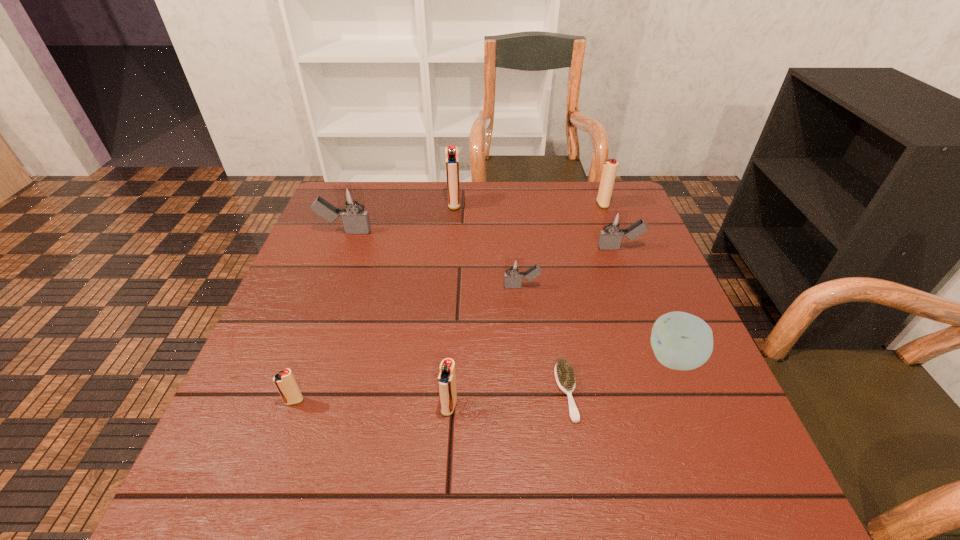
Identify the location of blank space located on the back of the smallest red igniter. This screenshot has height=540, width=960. (343, 266).

In order to click on vacant space located on the back of the smallest gray igniter in this screenshot , I will do `click(520, 267)`.

You are a GUI agent. You are given a task and a screenshot of the screen. Output one action in this format:
    pyautogui.click(x=<x>, y=<y>)
    Task: Click on the vacant space located on the right of the shortest object
    
    Given the screenshot: What is the action you would take?
    pyautogui.click(x=603, y=392)

You are a GUI agent. You are given a task and a screenshot of the screen. Output one action in this format:
    pyautogui.click(x=<x>, y=<y>)
    Task: Click on the apple that is at the right edge
    Image resolution: width=960 pixels, height=540 pixels.
    Given the screenshot: What is the action you would take?
    pyautogui.click(x=681, y=341)

Find the location of a particular element. object present at the far left corner is located at coordinates coord(355,220).

At what (x,y) coordinates should I click in order to perform the action: click on object located in the far right corner section of the desktop. Please return your answer as a coordinate pair (x, y). This screenshot has width=960, height=540. Looking at the image, I should click on (609, 170).

Locate an element on the screen. The height and width of the screenshot is (540, 960). vacant point at the far edge is located at coordinates (440, 214).

Locate an element on the screen. vacant region at the near edge of the desktop is located at coordinates (374, 474).

In the image, there is a desktop. Where is `vacant space at the left edge`? This screenshot has width=960, height=540. vacant space at the left edge is located at coordinates (297, 321).

Identify the location of free space at the right edge of the desktop. (657, 453).